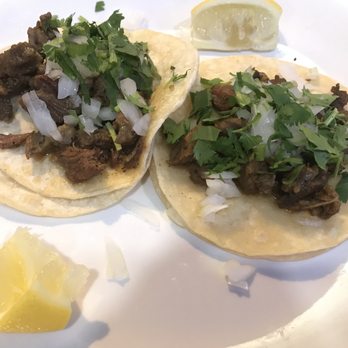
At what (x,y) coordinates should I click in order to perform the action: click on shadow on plate. Please return your answer as a coordinate pair (x, y). The image size is (348, 348). Looking at the image, I should click on (195, 316), (149, 193), (113, 208), (274, 53), (77, 337).